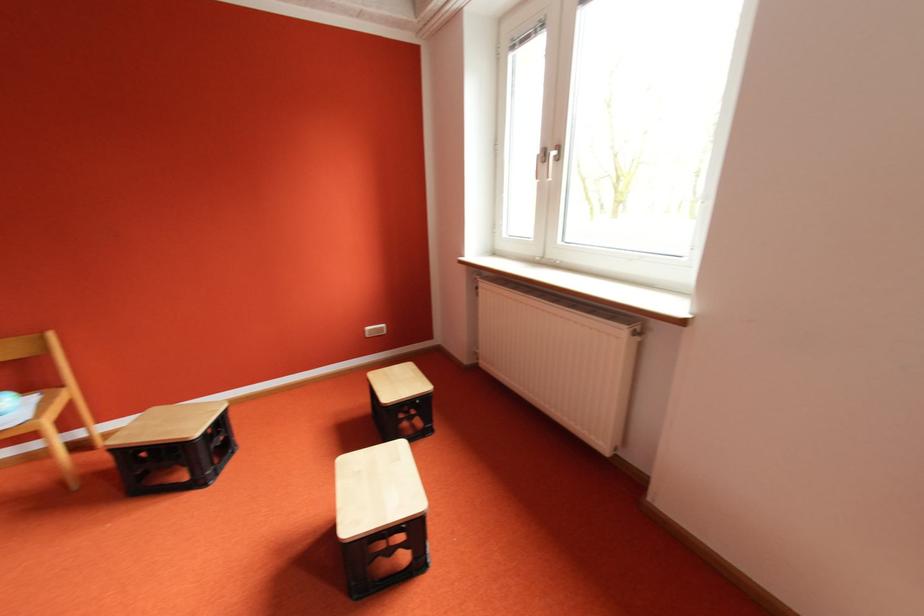
The width and height of the screenshot is (924, 616). What do you see at coordinates (551, 169) in the screenshot? I see `a white window handle` at bounding box center [551, 169].